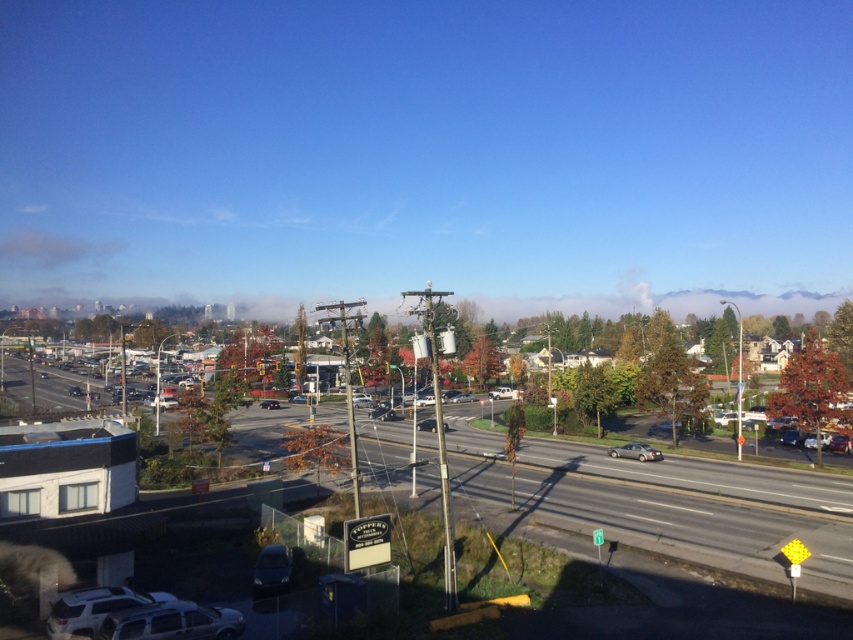
Question: Which of the following is the closest to the observer?

Choices:
 (A) (422, 420)
 (B) (631, 456)
 (C) (260, 404)
 (D) (576, 492)

Answer: (D)

Question: Which object is the closest to the metallic silver sedan at center?

Choices:
 (A) asphalt road at lower center
 (B) silver metallic sedan at center
 (C) matte black sedan at center

Answer: (A)

Question: Does asphalt road at lower center appear over silver metallic sedan at center?

Choices:
 (A) yes
 (B) no

Answer: (B)

Question: Can you confirm if asphalt road at lower center is bigger than matte black sedan at center?

Choices:
 (A) no
 (B) yes

Answer: (B)

Question: Considering the real-world distances, which object is closest to the asphalt road at lower center?

Choices:
 (A) silver metallic sedan at center
 (B) matte black sedan at center
 (C) shiny black sedan at center
 (D) metallic silver sedan at center

Answer: (D)

Question: Considering the relative positions of asphalt road at lower center and metallic silver sedan at center in the image provided, where is asphalt road at lower center located with respect to metallic silver sedan at center?

Choices:
 (A) above
 (B) below

Answer: (B)